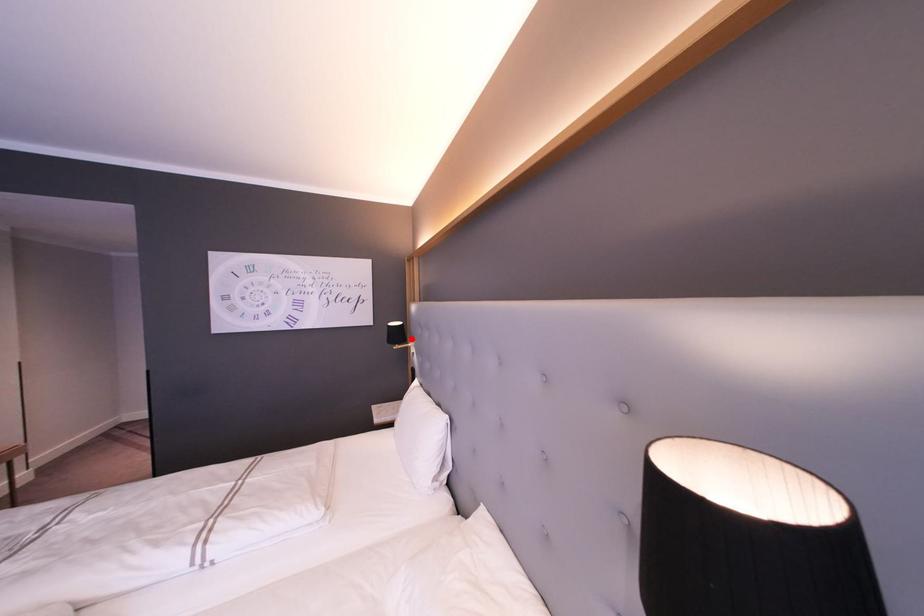
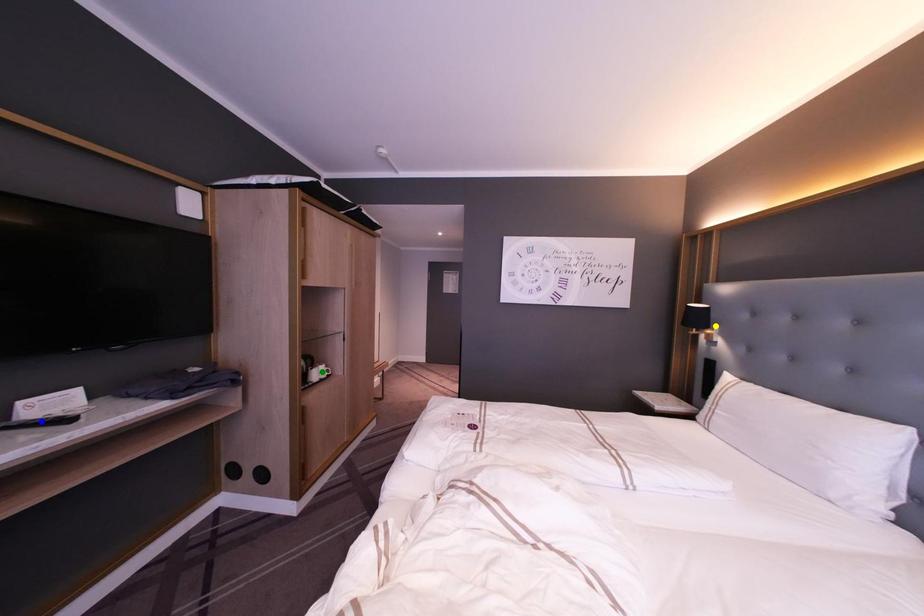
Question: I am providing you with two images of the same scene from different viewpoints. A red point is marked on the first image. You are given multiple points on the second image. Which point in image 2 represents the same 3d spot as the red point in image 1?

Choices:
 (A) yellow point
 (B) blue point
 (C) green point

Answer: (A)